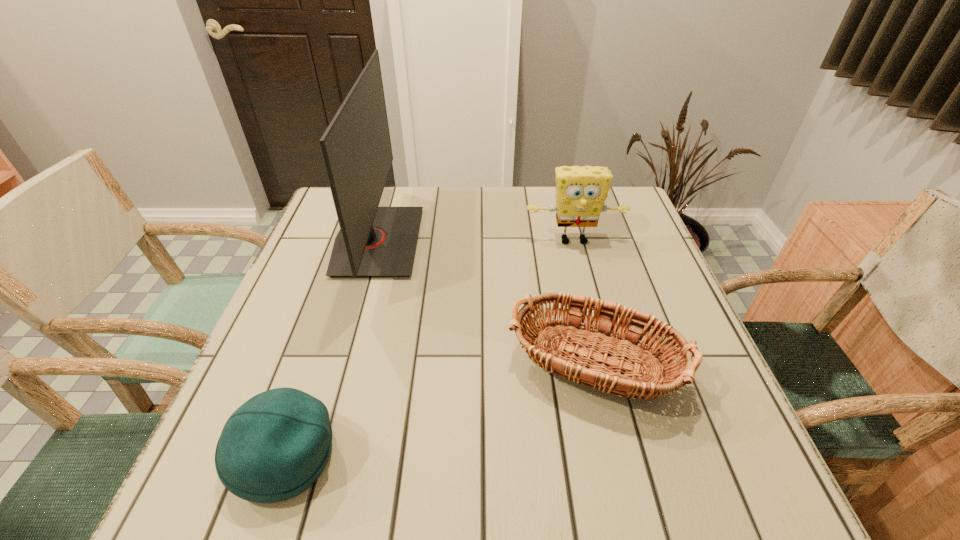
Identify the location of basket present at the near edge. Image resolution: width=960 pixels, height=540 pixels. (566, 333).

Where is `beanie present at the near edge`? The height and width of the screenshot is (540, 960). beanie present at the near edge is located at coordinates (274, 446).

You are a GUI agent. You are given a task and a screenshot of the screen. Output one action in this format:
    pyautogui.click(x=<x>, y=<y>)
    Task: Click on the monitor that is positioned at the left edge
    Image resolution: width=960 pixels, height=540 pixels.
    Given the screenshot: What is the action you would take?
    pyautogui.click(x=373, y=241)

Locate an element on the screen. beanie at the left edge is located at coordinates (274, 446).

Where is `sponge present at the right edge`? This screenshot has height=540, width=960. sponge present at the right edge is located at coordinates pos(581,192).

At what (x,y) coordinates should I click in order to perform the action: click on basket that is at the right edge. Please return your answer as a coordinate pair (x, y). Looking at the image, I should click on (566, 333).

Where is `object that is at the far left corner`? The image size is (960, 540). object that is at the far left corner is located at coordinates (373, 241).

Locate an element on the screen. Image resolution: width=960 pixels, height=540 pixels. object located at the near left corner is located at coordinates (274, 446).

Image resolution: width=960 pixels, height=540 pixels. I want to click on object that is at the far right corner, so click(581, 192).

Locate an element on the screen. object that is at the near right corner is located at coordinates (566, 333).